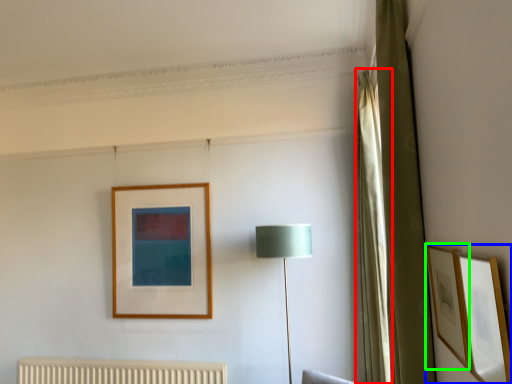
Question: Considering the real-world distances, which object is closest to curtain (highlighted by a red box)? picture frame (highlighted by a blue box) or picture frame (highlighted by a green box).

Choices:
 (A) picture frame
 (B) picture frame

Answer: (B)